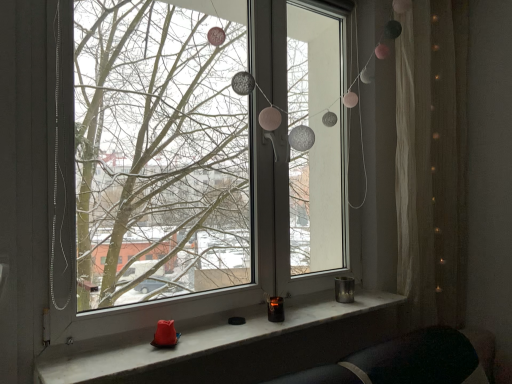
Describe the element at coordinates (197, 160) in the screenshot. The image size is (512, 384). I see `transparent glass window at center` at that location.

Find the location of a particular element. The height and width of the screenshot is (384, 512). white marble window sill at lower center is located at coordinates (231, 345).

From the image's perspective, is transparent glass window at center located above or below white marble window sill at lower center?

Based on their image positions, transparent glass window at center is located above white marble window sill at lower center.

The width and height of the screenshot is (512, 384). Identify the location of window that is above the white marble window sill at lower center (from the image's perspective). (197, 160).

Is transparent glass window at center positioned with its back to white marble window sill at lower center?

transparent glass window at center does not have its back to white marble window sill at lower center.

Is point (314, 114) closer to camera compared to point (275, 328)?

No, it is not.

In the image, is white sheer curtain at right positioned in front of or behind transparent glass window at center?

white sheer curtain at right is behind transparent glass window at center.

From a real-world perspective, is white sheer curtain at right physically below transparent glass window at center?

Yes.

From the image's perspective, which one is positioned lower, white sheer curtain at right or transparent glass window at center?

white sheer curtain at right appears lower in the image.

At what (x,y) coordinates should I click in order to perform the action: click on window on the left of the white sheer curtain at right. Please return your answer as a coordinate pair (x, y). Image resolution: width=512 pixels, height=384 pixels. Looking at the image, I should click on (197, 160).

Consider the image. From a real-world perspective, is white sheer curtain at right physically located above or below white marble window sill at lower center?

From a real-world perspective, white sheer curtain at right is physically above white marble window sill at lower center.

Can you confirm if white sheer curtain at right is positioned to the left of white marble window sill at lower center?

In fact, white sheer curtain at right is to the right of white marble window sill at lower center.

The width and height of the screenshot is (512, 384). What are the coordinates of `curtain behind the white marble window sill at lower center` in the screenshot? It's located at (430, 159).

Which is more to the left, transparent glass window at center or white sheer curtain at right?

transparent glass window at center.

Based on their sizes in the image, would you say transparent glass window at center is bigger or smaller than white sheer curtain at right?

Clearly, transparent glass window at center is larger in size than white sheer curtain at right.

Which of these two, transparent glass window at center or white sheer curtain at right, stands taller?

Standing taller between the two is white sheer curtain at right.

Is white marble window sill at lower center not inside transparent glass window at center?

Yes, white marble window sill at lower center is not within transparent glass window at center.

How different are the orientations of white marble window sill at lower center and transparent glass window at center in degrees?

0.00149 degrees.

From the image's perspective, is white marble window sill at lower center located beneath transparent glass window at center?

Indeed, from the image's perspective, white marble window sill at lower center is shown beneath transparent glass window at center.

The width and height of the screenshot is (512, 384). I want to click on window sill in front of the white sheer curtain at right, so click(231, 345).

From a real-world perspective, who is located higher, white marble window sill at lower center or white sheer curtain at right?

white sheer curtain at right, from a real-world perspective.

Does point (102, 368) come farther from viewer compared to point (430, 271)?

That is False.

Identify the location of window above the white marble window sill at lower center (from the image's perspective). The image size is (512, 384). (197, 160).

This screenshot has width=512, height=384. Identify the location of curtain on the right of the transparent glass window at center. (430, 159).

From the picture: Estimate the real-world distances between objects in this image. Which object is closer to transparent glass window at center, white marble window sill at lower center or white sheer curtain at right?

white sheer curtain at right lies closer to transparent glass window at center than the other object.

Which object lies nearer to the anchor point transparent glass window at center, white sheer curtain at right or white marble window sill at lower center?

Based on the image, white sheer curtain at right appears to be nearer to transparent glass window at center.

Based on their spatial positions, is white marble window sill at lower center or transparent glass window at center further from white sheer curtain at right?

transparent glass window at center lies further to white sheer curtain at right than the other object.

Estimate the real-world distances between objects in this image. Which object is further from white sheer curtain at right, transparent glass window at center or white marble window sill at lower center?

transparent glass window at center.

From the image, which object appears to be farther from white marble window sill at lower center, white sheer curtain at right or transparent glass window at center?

transparent glass window at center is positioned further to the anchor white marble window sill at lower center.

Estimate the real-world distances between objects in this image. Which object is further from white marble window sill at lower center, transparent glass window at center or white sheer curtain at right?

transparent glass window at center.

At what (x,y) coordinates should I click in order to perform the action: click on window sill situated between transparent glass window at center and white sheer curtain at right from left to right. Please return your answer as a coordinate pair (x, y). Looking at the image, I should click on (231, 345).